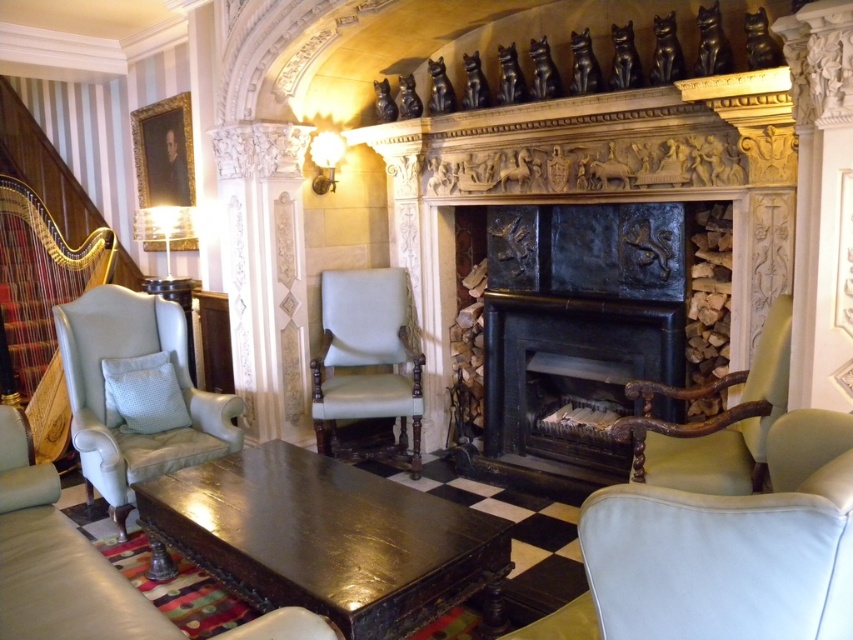
Is light beige fabric armchair at center to the left of metallic glass at upper left from the viewer's perspective?

No, light beige fabric armchair at center is not to the left of metallic glass at upper left.

Can you confirm if light beige fabric armchair at center is positioned below metallic glass at upper left?

Correct, light beige fabric armchair at center is located below metallic glass at upper left.

Where is `light beige fabric armchair at center`? The height and width of the screenshot is (640, 853). light beige fabric armchair at center is located at coordinates (367, 362).

I want to click on light beige fabric armchair at center, so click(x=367, y=362).

Can you confirm if leather couch at center is taller than light blue leather armchair at left?

Incorrect, leather couch at center's height is not larger of light blue leather armchair at left's.

Is point (24, 484) closer to viewer compared to point (117, 346)?

Yes, point (24, 484) is in front of point (117, 346).

In order to click on leather couch at center in this screenshot , I will do `click(57, 561)`.

Is leather couch at center below light beige fabric armchair at center?

Yes, leather couch at center is below light beige fabric armchair at center.

Which is behind, point (125, 611) or point (393, 397)?

Positioned behind is point (393, 397).

Who is more distant from viewer, (238, 632) or (392, 385)?

The point (392, 385) is more distant.

I want to click on leather couch at center, so click(x=57, y=561).